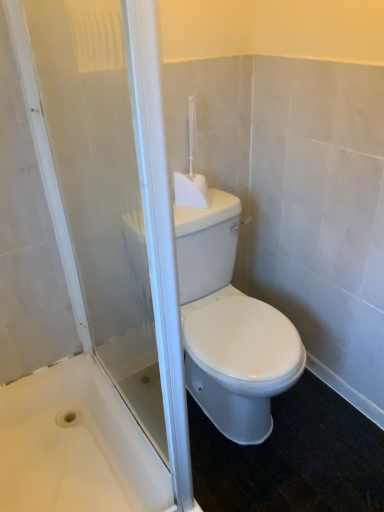
Question: Is white glossy toilet at center shorter than white glossy bathtub at lower left?

Choices:
 (A) yes
 (B) no

Answer: (B)

Question: Is white glossy toilet at center positioned far away from white glossy bathtub at lower left?

Choices:
 (A) yes
 (B) no

Answer: (B)

Question: From the image's perspective, is white glossy toilet at center under white glossy bathtub at lower left?

Choices:
 (A) no
 (B) yes

Answer: (A)

Question: Considering the relative sizes of white glossy toilet at center and white glossy bathtub at lower left in the image provided, is white glossy toilet at center bigger than white glossy bathtub at lower left?

Choices:
 (A) no
 (B) yes

Answer: (B)

Question: Considering the relative sizes of white glossy toilet at center and white glossy bathtub at lower left in the image provided, is white glossy toilet at center taller than white glossy bathtub at lower left?

Choices:
 (A) yes
 (B) no

Answer: (A)

Question: Is point (109, 486) positioned closer to the camera than point (24, 406)?

Choices:
 (A) closer
 (B) farther

Answer: (A)

Question: Considering the positions of white glossy bathtub at lower left and transparent glass screen door at center in the image, is white glossy bathtub at lower left taller or shorter than transparent glass screen door at center?

Choices:
 (A) short
 (B) tall

Answer: (A)

Question: In terms of width, does white glossy bathtub at lower left look wider or thinner when compared to transparent glass screen door at center?

Choices:
 (A) thin
 (B) wide

Answer: (B)

Question: Do you think white glossy bathtub at lower left is within transparent glass screen door at center, or outside of it?

Choices:
 (A) outside
 (B) inside

Answer: (A)

Question: From the image's perspective, is white plastic toilet brush at upper center located above or below transparent glass screen door at center?

Choices:
 (A) below
 (B) above

Answer: (B)

Question: Is point (188, 120) closer or farther from the camera than point (33, 86)?

Choices:
 (A) farther
 (B) closer

Answer: (A)

Question: Relative to transparent glass screen door at center, is white plastic toilet brush at upper center in front or behind?

Choices:
 (A) behind
 (B) front

Answer: (A)

Question: Is white plastic toilet brush at upper center wider or thinner than transparent glass screen door at center?

Choices:
 (A) thin
 (B) wide

Answer: (B)

Question: Is transparent glass screen door at center situated inside white glossy bathtub at lower left or outside?

Choices:
 (A) inside
 (B) outside

Answer: (B)

Question: Is transparent glass screen door at center in front of or behind white glossy bathtub at lower left in the image?

Choices:
 (A) behind
 (B) front

Answer: (B)